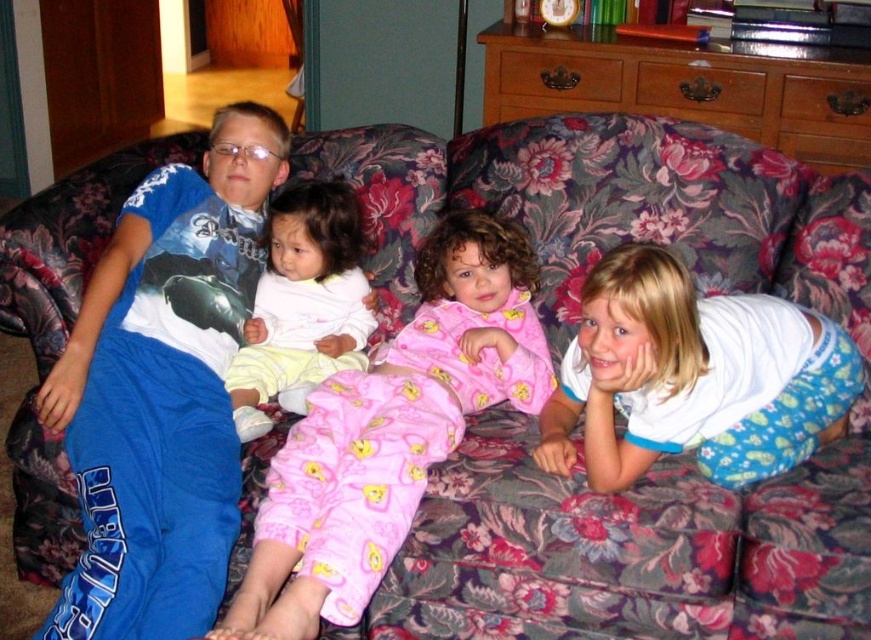
Between point (620, 323) and point (332, 301), which one is positioned behind?

The point (332, 301) is more distant.

The image size is (871, 640). What are the coordinates of `white cotton shirt at right` in the screenshot? It's located at (693, 376).

Is pink cotton pajamas at center smaller than white soft baby at center?

No.

Who is more distant from viewer, (541,358) or (311,257)?

The point (311,257) is more distant.

The height and width of the screenshot is (640, 871). I want to click on pink cotton pajamas at center, so click(390, 432).

Between pink cotton pajamas at center and white cotton shirt at right, which one is positioned lower?

Positioned lower is pink cotton pajamas at center.

Can you confirm if pink cotton pajamas at center is shorter than white cotton shirt at right?

Incorrect, pink cotton pajamas at center's height does not fall short of white cotton shirt at right's.

Where is `pink cotton pajamas at center`? The image size is (871, 640). pink cotton pajamas at center is located at coordinates (390, 432).

The image size is (871, 640). Find the location of `pink cotton pajamas at center`. pink cotton pajamas at center is located at coordinates tap(390, 432).